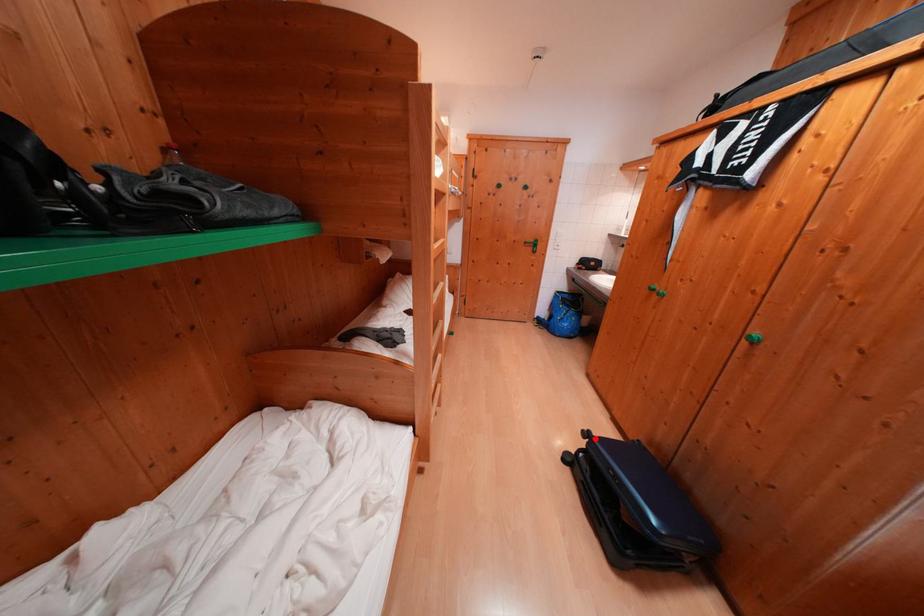
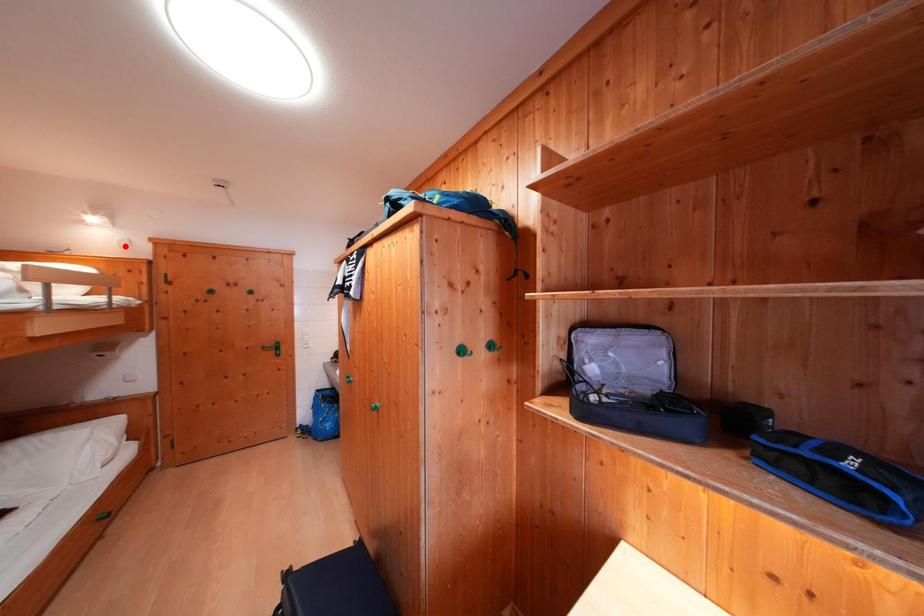
I am providing you with two images of the same scene from different viewpoints. A red point is marked on the first image and another point is marked on the second image. Is the red point in image1 aligned with the point shown in image2?

No